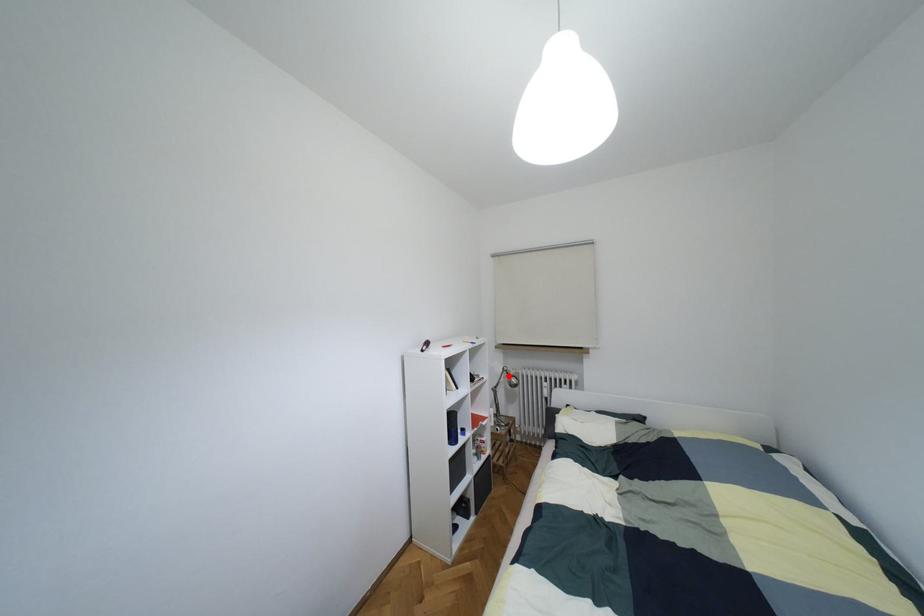
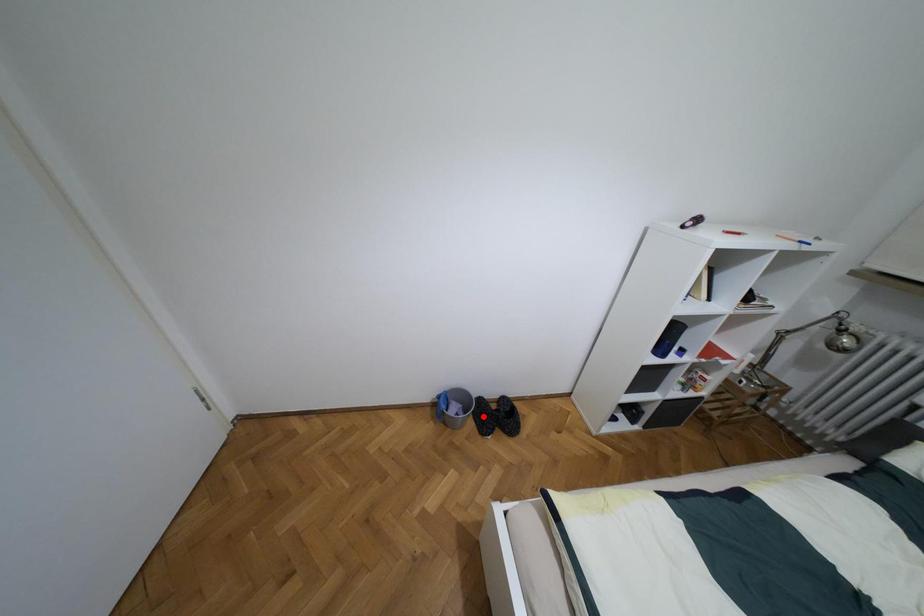
I am providing you with two images of the same scene from different viewpoints. A red point is marked on the first image and another point is marked on the second image. Is the marked point in image1 the same physical position as the marked point in image2?

No